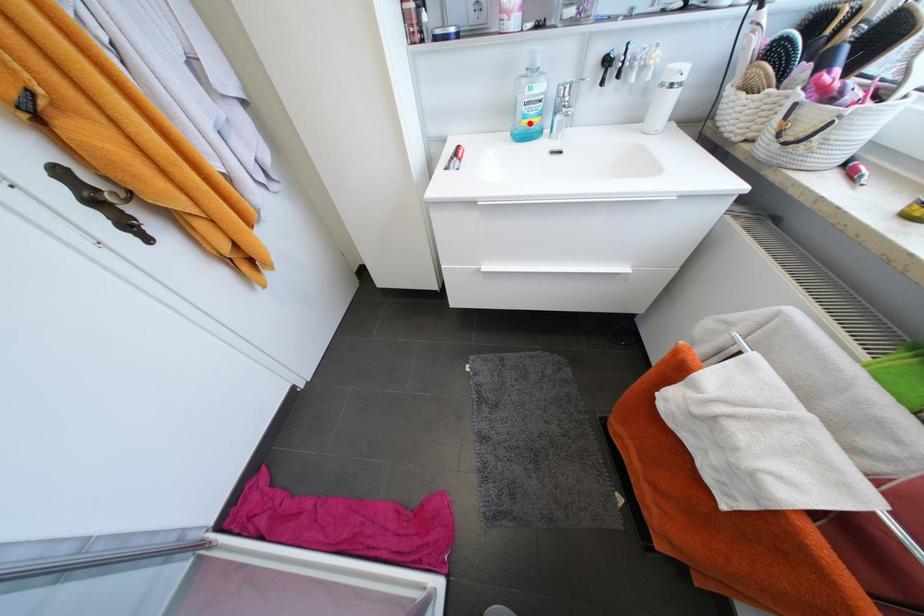
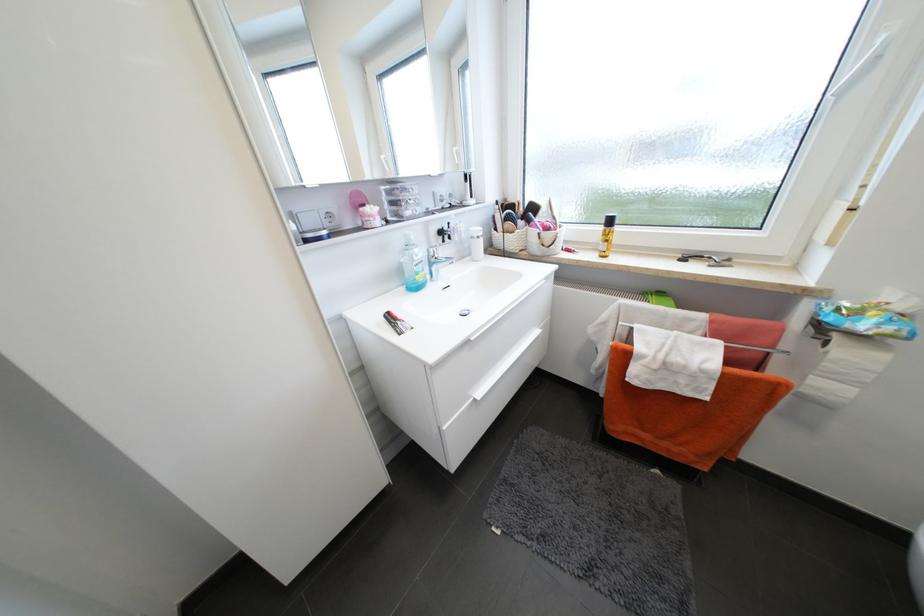
In the second image, find the point that corresponds to the highlighted location in the first image.

(423, 278)